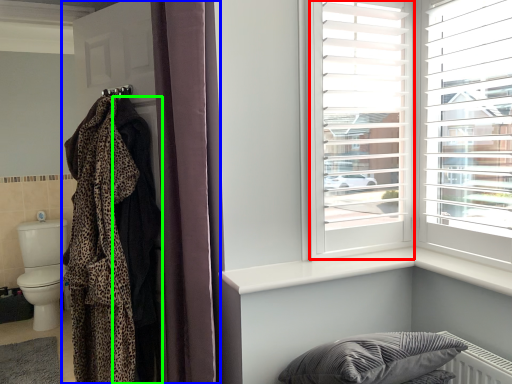
Question: Which is nearer to the window frame (highlighted by a red box)? closet (highlighted by a blue box) or robe (highlighted by a green box).

Choices:
 (A) closet
 (B) robe

Answer: (A)